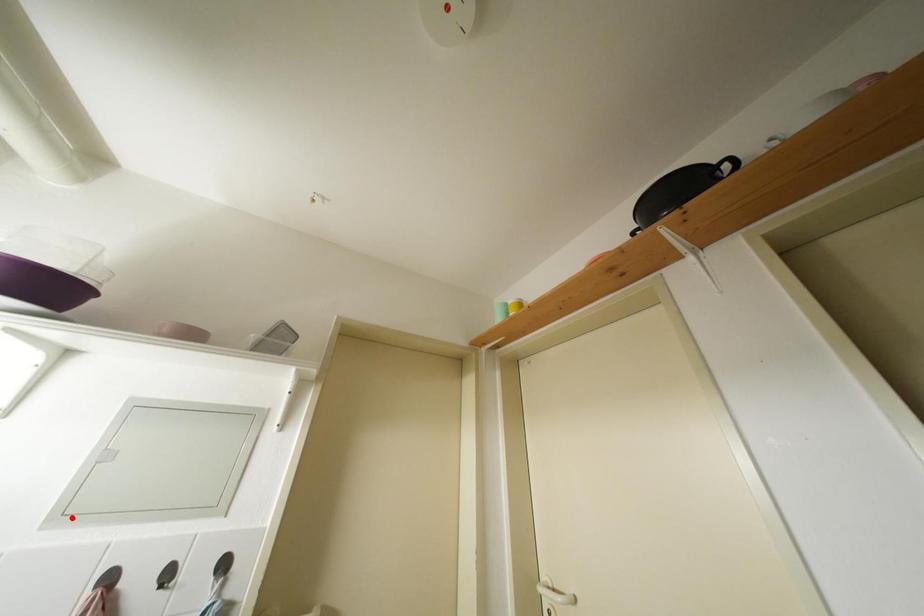
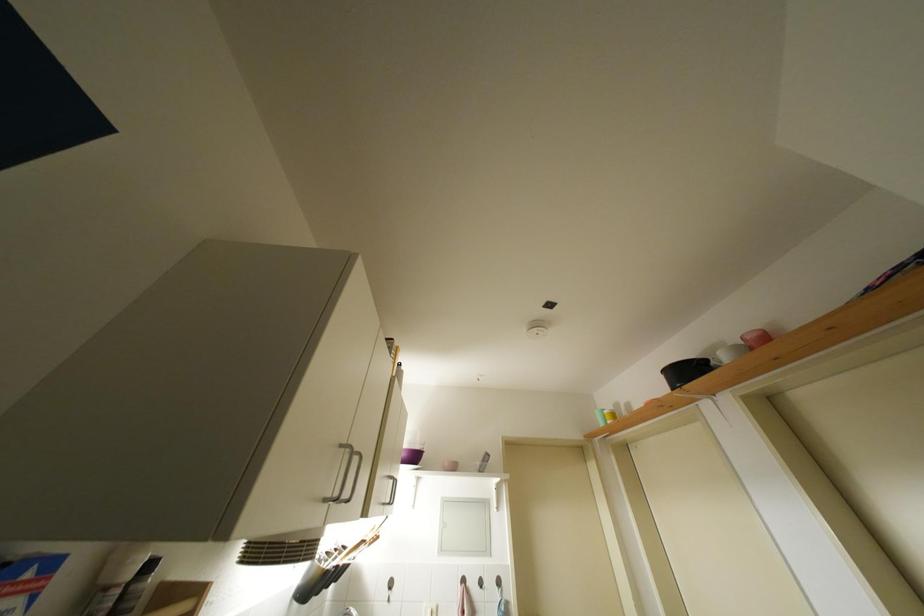
Where in the second image is the point corresponding to the highlighted location from the first image?

(447, 554)